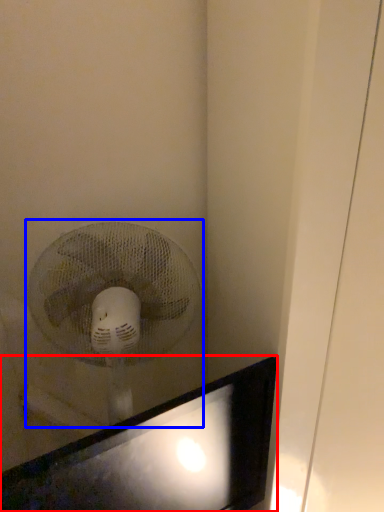
Question: Which of the following is the farthest to the observer, computer monitor (highlighted by a red box) or mechanical fan (highlighted by a blue box)?

Choices:
 (A) computer monitor
 (B) mechanical fan

Answer: (B)